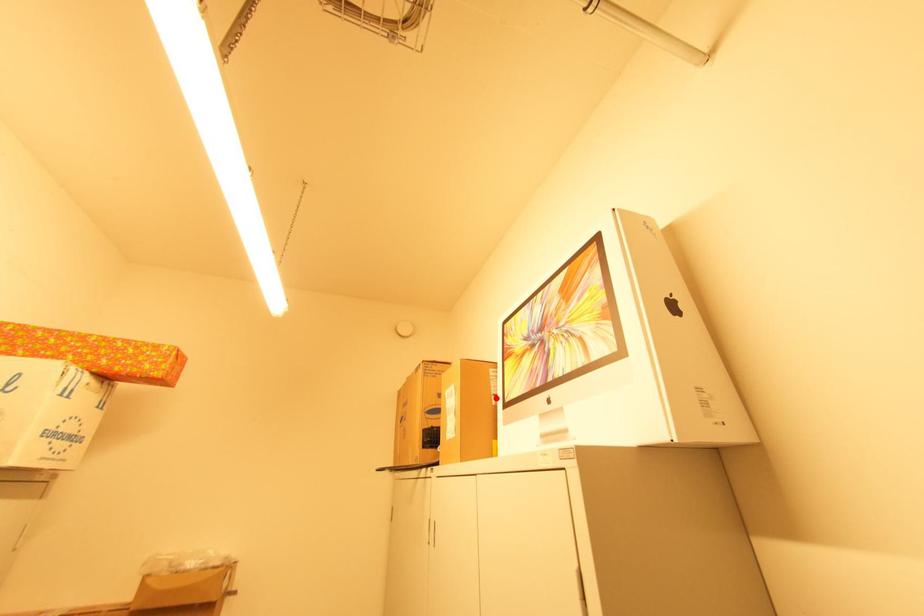
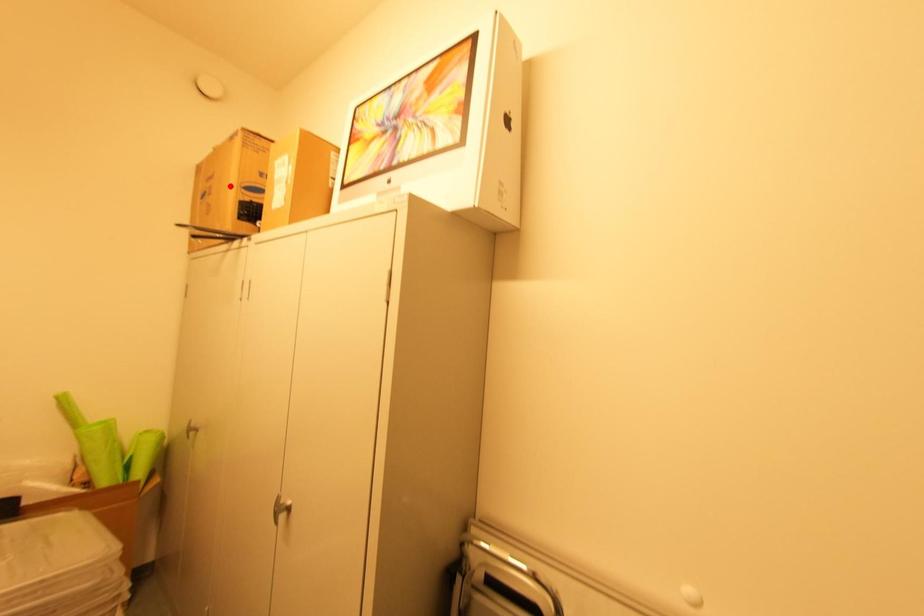
I am providing you with two images of the same scene from different viewpoints. A red point is marked on the first image and another point is marked on the second image. Are the points marked in image1 and image2 representing the same 3D position?

No